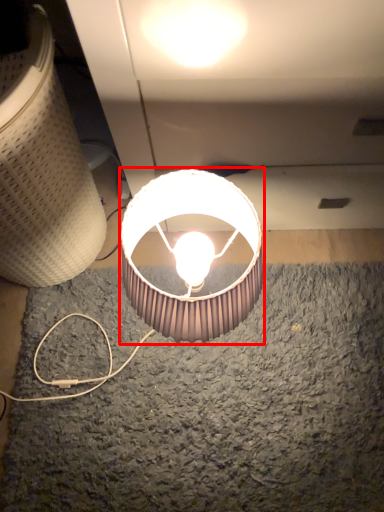
Question: Where is lamp (annotated by the red box) located in relation to lamp in the image?

Choices:
 (A) right
 (B) left

Answer: (A)